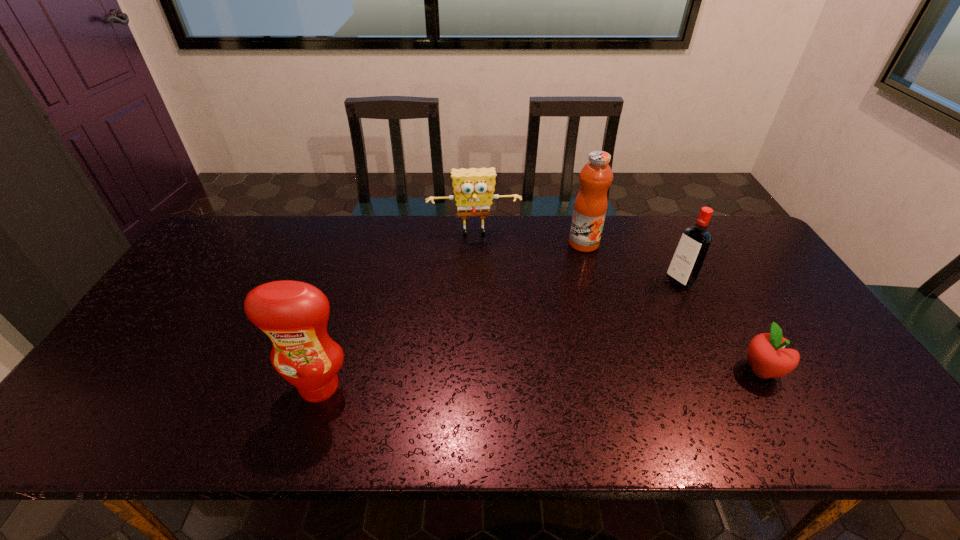
The image size is (960, 540). Identify the location of free region that satisfies the following two spatial constraints: 1. on the front side of the third farthest object; 2. on the side where a bite is taken out of the rightmost object. (724, 370).

Where is `vacant space that satisfies the following two spatial constraints: 1. on the front side of the sponge; 2. on the side where a bite is taken out of the apple`? vacant space that satisfies the following two spatial constraints: 1. on the front side of the sponge; 2. on the side where a bite is taken out of the apple is located at coordinates (471, 370).

Locate an element on the screen. free space that satisfies the following two spatial constraints: 1. on the front side of the fourth object from left to right; 2. on the left side of the third object from right to left is located at coordinates (594, 281).